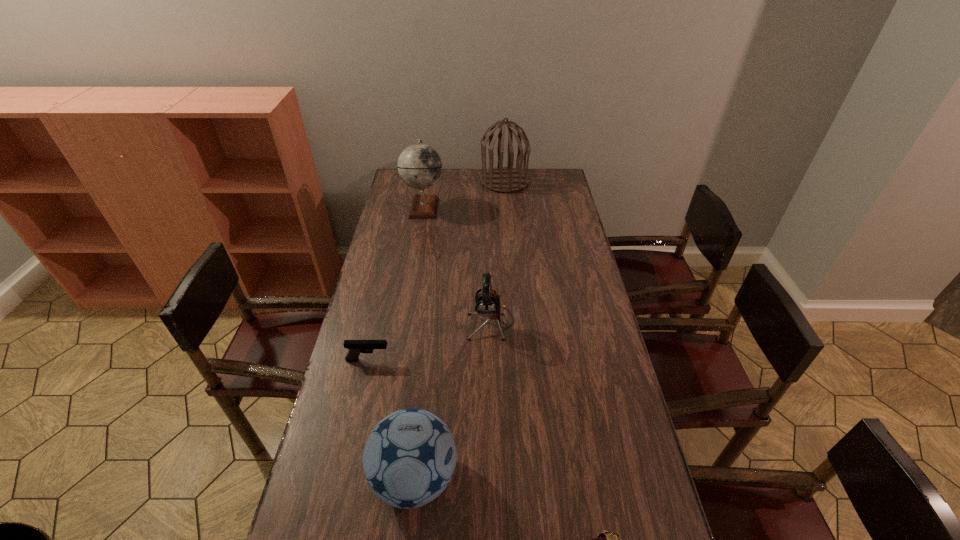
Image resolution: width=960 pixels, height=540 pixels. I want to click on object at the far edge, so click(501, 179).

Identify the location of globe at the left edge. Image resolution: width=960 pixels, height=540 pixels. (419, 165).

Identify the location of soccer ball present at the left edge. The image size is (960, 540). (409, 458).

Locate an element on the screen. Image resolution: width=960 pixels, height=540 pixels. pistol located in the left edge section of the desktop is located at coordinates (355, 347).

Where is `blank space at the far edge of the desktop`? blank space at the far edge of the desktop is located at coordinates (466, 187).

The height and width of the screenshot is (540, 960). I want to click on free region at the left edge of the desktop, so click(390, 221).

Where is `vacant space at the right edge of the desktop`? This screenshot has height=540, width=960. vacant space at the right edge of the desktop is located at coordinates (547, 211).

In the image, there is a desktop. Identify the location of free space at the far right corner. (547, 174).

Identify the location of unoccupied area between the third nearest object and the second farthest object. (396, 284).

Find the location of a particular element. The image size is (960, 540). empty space between the globe and the farthest object is located at coordinates (465, 194).